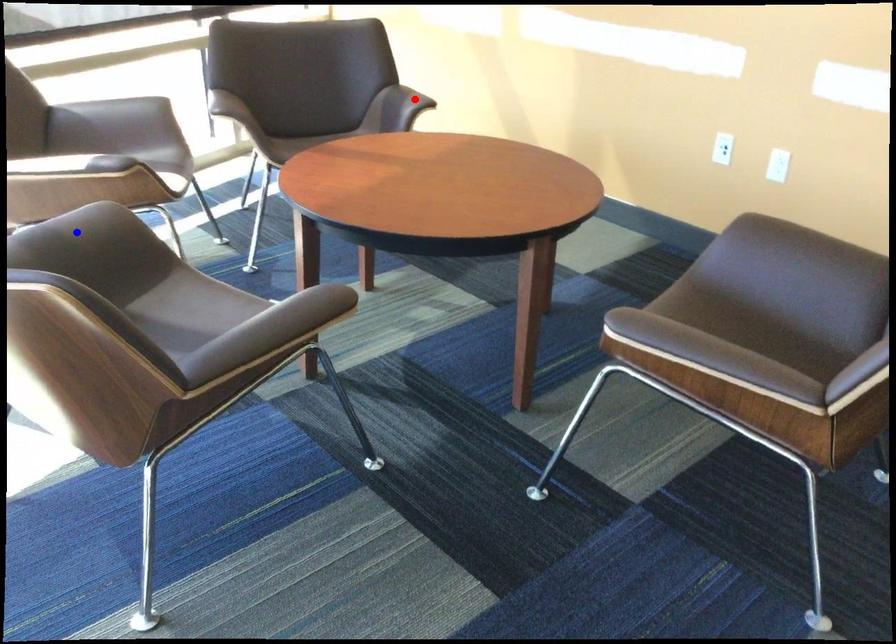
Question: In the image, two points are highlighted. Which point is nearer to the camera? Reply with the corresponding letter.

Choices:
 (A) blue point
 (B) red point

Answer: (A)